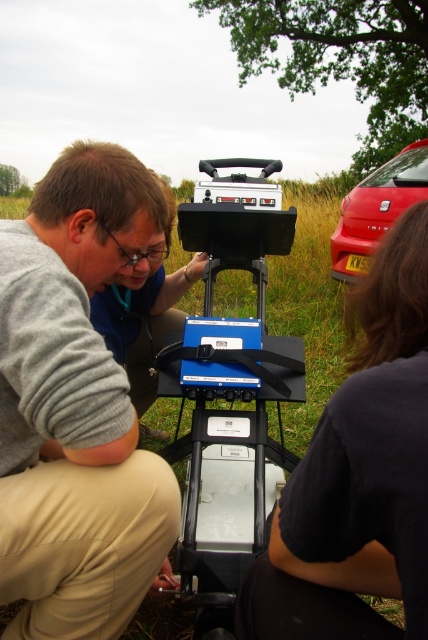
Consider the image. You are a photographer standing behind the surveying equipment and want to take a picture of the gray fabric shirt at center and dark gray fabric at lower right. Which object will appear taller in the photo?

The gray fabric shirt at center will appear taller in the photo because it has a greater height compared to the dark gray fabric at lower right.

You are a pedestrian standing at the edge of the grassy field. You see the gray fabric shirt at center and the metallic red car at right. Which object is closer to your right side?

The metallic red car at right is closer to your right side because it is positioned to the right of the gray fabric shirt at center.